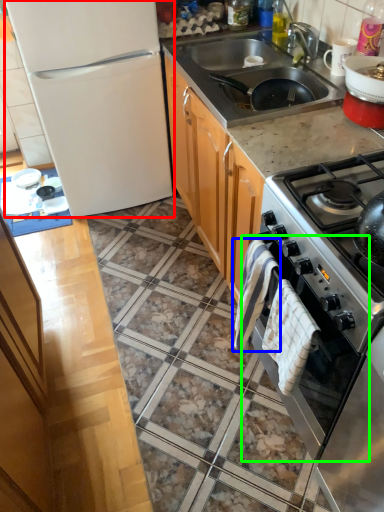
Question: Considering the real-world distances, which object is farthest from refrigerator (highlighted by a red box)? blanket (highlighted by a blue box) or oven (highlighted by a green box)?

Choices:
 (A) blanket
 (B) oven

Answer: (B)